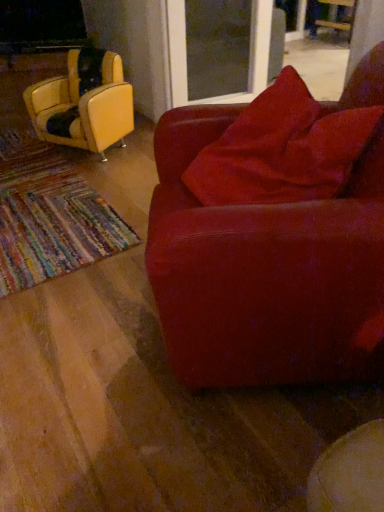
Question: Is leather yellow chair at left, arranged as the third chair when viewed from the right, further to camera compared to wooden chair at upper right, acting as the 3th chair starting from the left?

Choices:
 (A) no
 (B) yes

Answer: (A)

Question: From the image's perspective, is leather yellow chair at left, arranged as the third chair when viewed from the right, located above wooden chair at upper right, the first chair from the top?

Choices:
 (A) no
 (B) yes

Answer: (A)

Question: Considering the relative positions of leather yellow chair at left, arranged as the third chair when viewed from the right, and wooden chair at upper right, the first chair from the top, in the image provided, is leather yellow chair at left, arranged as the third chair when viewed from the right, in front of wooden chair at upper right, the first chair from the top,?

Choices:
 (A) no
 (B) yes

Answer: (B)

Question: Is wooden chair at upper right, the first chair from the back, inside leather yellow chair at left, the 1th chair viewed from the left?

Choices:
 (A) yes
 (B) no

Answer: (B)

Question: Is leather yellow chair at left, arranged as the third chair when viewed from the right, at the left side of wooden chair at upper right, acting as the 3th chair starting from the front?

Choices:
 (A) no
 (B) yes

Answer: (B)

Question: Is wooden chair at upper right, the first chair from the back, inside or outside of leather yellow chair at left, which is the second chair in front-to-back order?

Choices:
 (A) outside
 (B) inside

Answer: (A)

Question: Looking at their shapes, would you say wooden chair at upper right, positioned as the third chair in bottom-to-top order, is wider or thinner than leather yellow chair at left, which is the second chair in front-to-back order?

Choices:
 (A) thin
 (B) wide

Answer: (B)

Question: Is wooden chair at upper right, positioned as the third chair in bottom-to-top order, to the left or to the right of leather yellow chair at left, the 1th chair viewed from the left, in the image?

Choices:
 (A) left
 (B) right

Answer: (B)

Question: In terms of height, does wooden chair at upper right, the first chair from the top, look taller or shorter compared to leather yellow chair at left, placed as the 2th chair when sorted from back to front?

Choices:
 (A) short
 (B) tall

Answer: (A)

Question: In terms of size, does wooden chair at upper right, positioned as the third chair in bottom-to-top order, appear bigger or smaller than transparent glass screen door at upper center?

Choices:
 (A) small
 (B) big

Answer: (A)

Question: Considering the positions of point (350, 31) and point (259, 53), is point (350, 31) closer or farther from the camera than point (259, 53)?

Choices:
 (A) closer
 (B) farther

Answer: (B)

Question: Based on their positions, is wooden chair at upper right, the first chair from the back, located to the left or right of transparent glass screen door at upper center?

Choices:
 (A) left
 (B) right

Answer: (B)

Question: Looking at their shapes, would you say wooden chair at upper right, positioned as the third chair in bottom-to-top order, is wider or thinner than transparent glass screen door at upper center?

Choices:
 (A) wide
 (B) thin

Answer: (B)

Question: Does point (215, 99) appear closer or farther from the camera than point (336, 20)?

Choices:
 (A) farther
 (B) closer

Answer: (B)

Question: Considering the positions of transparent glass screen door at upper center and wooden chair at upper right, acting as the 3th chair starting from the left, in the image, is transparent glass screen door at upper center taller or shorter than wooden chair at upper right, acting as the 3th chair starting from the left,?

Choices:
 (A) short
 (B) tall

Answer: (B)